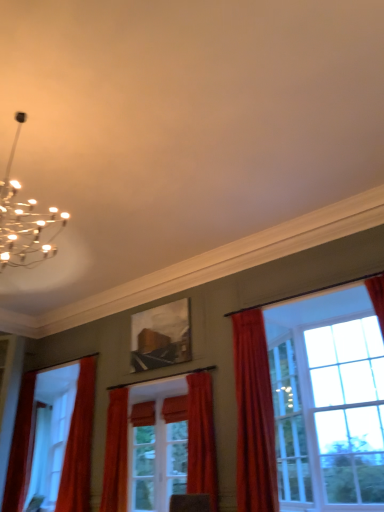
Question: Considering the relative sizes of matte wooden picture frame at center and matte red curtain at left, the first curtain from the left, in the image provided, is matte wooden picture frame at center wider than matte red curtain at left, the first curtain from the left,?

Choices:
 (A) no
 (B) yes

Answer: (A)

Question: From the image's perspective, is matte wooden picture frame at center below matte red curtain at left, the 5th curtain from the right?

Choices:
 (A) no
 (B) yes

Answer: (A)

Question: Is matte wooden picture frame at center located outside matte red curtain at left, the first curtain from the left?

Choices:
 (A) no
 (B) yes

Answer: (B)

Question: Is matte wooden picture frame at center far away from matte red curtain at left, the 5th curtain from the right?

Choices:
 (A) no
 (B) yes

Answer: (B)

Question: Considering the relative sizes of matte wooden picture frame at center and matte red curtain at left, the 5th curtain from the right, in the image provided, is matte wooden picture frame at center shorter than matte red curtain at left, the 5th curtain from the right,?

Choices:
 (A) no
 (B) yes

Answer: (B)

Question: Is matte wooden picture frame at center at the right side of matte red curtain at left, the 5th curtain from the right?

Choices:
 (A) no
 (B) yes

Answer: (B)

Question: Does velvet red curtain at right, the first curtain in the right-to-left sequence, have a smaller size compared to matte orange curtain at center, which is the 3th curtain from left to right?

Choices:
 (A) no
 (B) yes

Answer: (A)

Question: Is velvet red curtain at right, which is counted as the 5th curtain, starting from the left, oriented away from matte orange curtain at center, which is the 3th curtain from left to right?

Choices:
 (A) no
 (B) yes

Answer: (A)

Question: Considering the relative positions of velvet red curtain at right, which is counted as the 5th curtain, starting from the left, and matte orange curtain at center, which is the 3th curtain from left to right, in the image provided, is velvet red curtain at right, which is counted as the 5th curtain, starting from the left, to the right of matte orange curtain at center, which is the 3th curtain from left to right, from the viewer's perspective?

Choices:
 (A) yes
 (B) no

Answer: (A)

Question: Is velvet red curtain at right, which is counted as the 5th curtain, starting from the left, closer to camera compared to matte orange curtain at center, which is the 3th curtain from left to right?

Choices:
 (A) yes
 (B) no

Answer: (A)

Question: Is velvet red curtain at right, the first curtain in the right-to-left sequence, wider than matte orange curtain at center, which is the 3th curtain from left to right?

Choices:
 (A) no
 (B) yes

Answer: (B)

Question: Considering the relative sizes of velvet red curtain at right, which is counted as the 5th curtain, starting from the left, and matte orange curtain at center, which is the 3th curtain from left to right, in the image provided, is velvet red curtain at right, which is counted as the 5th curtain, starting from the left, taller than matte orange curtain at center, which is the 3th curtain from left to right,?

Choices:
 (A) no
 (B) yes

Answer: (B)

Question: Is velvet red curtain at right, which is counted as the 5th curtain, starting from the left, smaller than matte wooden picture frame at center?

Choices:
 (A) no
 (B) yes

Answer: (A)